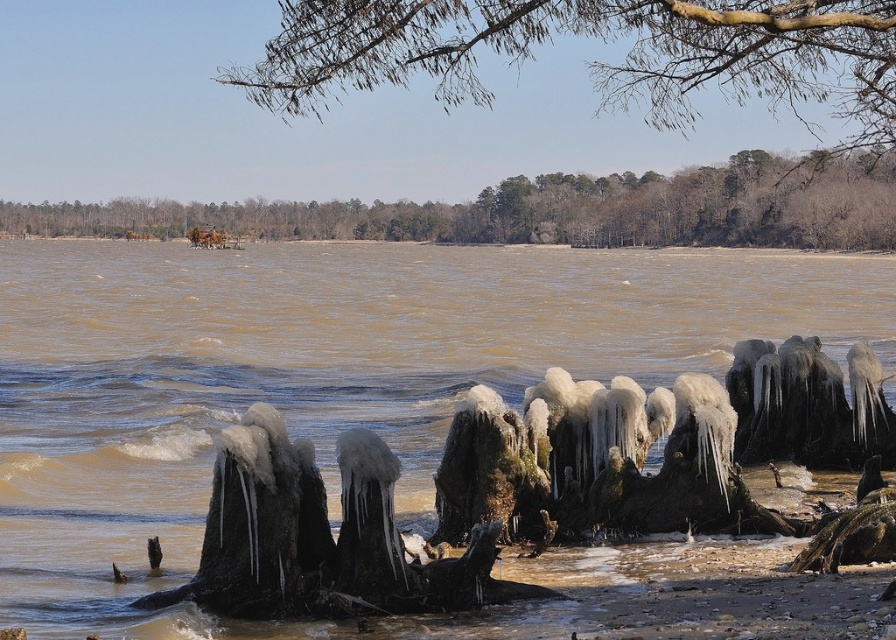
Can you confirm if bare branches at upper center is positioned to the right of brown wood trees at upper center?

Yes, bare branches at upper center is to the right of brown wood trees at upper center.

Where is `bare branches at upper center`? The width and height of the screenshot is (896, 640). bare branches at upper center is located at coordinates (595, 60).

I want to click on bare branches at upper center, so click(595, 60).

Does brown muddy water at center have a larger size compared to brown wood trees at upper center?

Yes.

In the scene shown: Who is taller, brown muddy water at center or brown wood trees at upper center?

Standing taller between the two is brown muddy water at center.

The height and width of the screenshot is (640, 896). I want to click on brown muddy water at center, so click(x=326, y=364).

What are the coordinates of `brown muddy water at center` in the screenshot? It's located at (326, 364).

Is point (587, 342) positioned behind point (350, 45)?

Yes.

Is brown muddy water at center positioned at the back of bare branches at upper center?

Yes, it is.

The width and height of the screenshot is (896, 640). I want to click on brown muddy water at center, so click(326, 364).